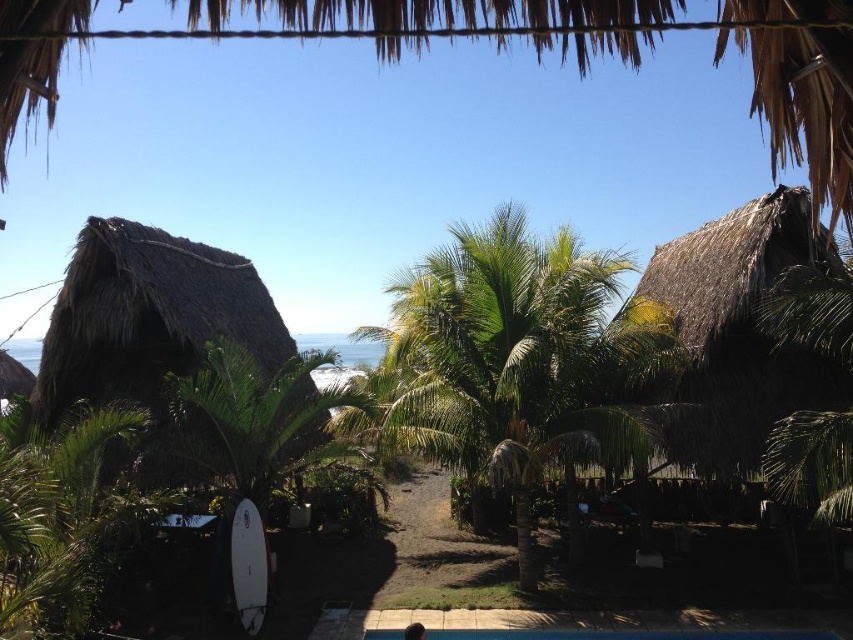
Question: Is the position of green leafy palm tree at center more distant than that of thatched roof hut at right?

Choices:
 (A) yes
 (B) no

Answer: (B)

Question: Which of these objects is positioned closest to the white matte surfboard at lower left?

Choices:
 (A) green leafy palm tree at center
 (B) dark brown hair at lower center
 (C) thatched brown hut at left
 (D) thatched roof hut at right

Answer: (B)

Question: Which of the following is the farthest from the observer?

Choices:
 (A) (622, 442)
 (B) (370, 637)

Answer: (A)

Question: Which is farther from the dark brown hair at lower center?

Choices:
 (A) thatched brown hut at left
 (B) blue smooth pool at center
 (C) green leafy palm tree at center

Answer: (A)

Question: Can you confirm if thatched roof hut at right is positioned below dark brown hair at lower center?

Choices:
 (A) no
 (B) yes

Answer: (A)

Question: Can you confirm if thatched brown hut at left is positioned to the right of white matte surfboard at lower left?

Choices:
 (A) yes
 (B) no

Answer: (B)